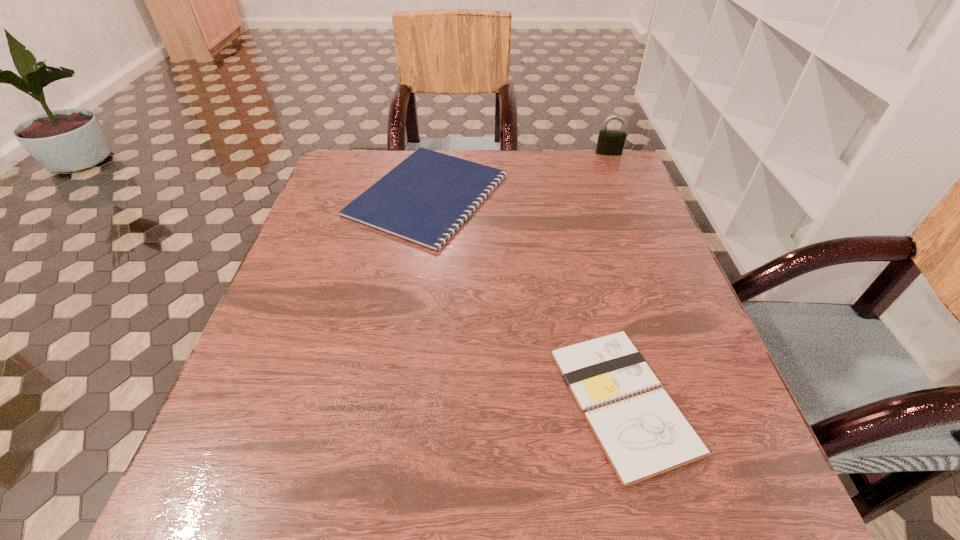
The height and width of the screenshot is (540, 960). Find the location of `unoccupied position between the tallest object and the nearest object`. unoccupied position between the tallest object and the nearest object is located at coordinates (615, 277).

I want to click on free space between the tallest object and the leftmost object, so click(518, 174).

This screenshot has height=540, width=960. I want to click on empty space that is in between the padlock and the left notepad, so click(518, 174).

Point out which object is positioned as the nearest to the padlock. Please provide its 2D coordinates. Your answer should be formatted as a tuple, i.e. [(x, y)], where the tuple contains the x and y coordinates of a point satisfying the conditions above.

[(424, 199)]

Find the location of a particular element. This screenshot has height=540, width=960. object that is the second closest one to the tallest object is located at coordinates (642, 436).

Identify the location of free space that satisfies the following two spatial constraints: 1. on the back side of the right notepad; 2. on the right side of the padlock. (561, 153).

Identify the location of vacant region that satisfies the following two spatial constraints: 1. on the back side of the right notepad; 2. on the left side of the tallest object. (561, 153).

Where is `vacant region that satisfies the following two spatial constraints: 1. on the back side of the tallest object; 2. on the right side of the nearest object`? The width and height of the screenshot is (960, 540). vacant region that satisfies the following two spatial constraints: 1. on the back side of the tallest object; 2. on the right side of the nearest object is located at coordinates (561, 153).